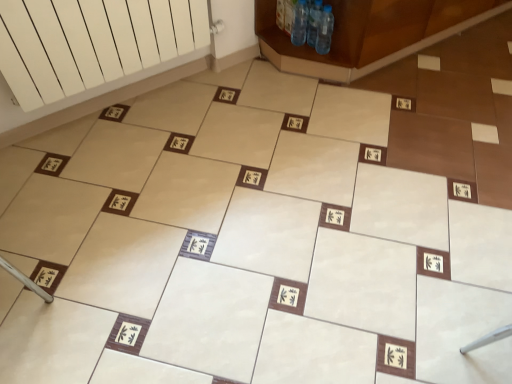
The height and width of the screenshot is (384, 512). What do you see at coordinates (298, 23) in the screenshot?
I see `transparent plastic bottles at upper center, which is counted as the 1th bottle, starting from the left` at bounding box center [298, 23].

I want to click on transparent plastic bottles at upper center, positioned as the first bottle in right-to-left order, so click(x=324, y=31).

Is transparent plastic bottles at upper center, positioned as the first bottle in right-to-left order, not close to clear plastic bottle at upper center, which appears as the second bottle when viewed from the left?

No.

Does transparent plastic bottles at upper center, positioned as the first bottle in right-to-left order, come in front of clear plastic bottle at upper center, which appears as the second bottle when viewed from the left?

Yes, transparent plastic bottles at upper center, positioned as the first bottle in right-to-left order, is closer to the viewer.

Considering the sizes of transparent plastic bottles at upper center, positioned as the first bottle in right-to-left order, and clear plastic bottle at upper center, which appears as the second bottle when viewed from the right, in the image, is transparent plastic bottles at upper center, positioned as the first bottle in right-to-left order, wider or thinner than clear plastic bottle at upper center, which appears as the second bottle when viewed from the right,?

Considering their sizes, transparent plastic bottles at upper center, positioned as the first bottle in right-to-left order, looks slimmer than clear plastic bottle at upper center, which appears as the second bottle when viewed from the right.

Is white matte radiator at upper left far away from brown wooden cabinet at upper right?

No, white matte radiator at upper left is in close proximity to brown wooden cabinet at upper right.

Does point (66, 55) come closer to viewer compared to point (402, 34)?

Yes, point (66, 55) is in front of point (402, 34).

Based on the photo, between white matte radiator at upper left and brown wooden cabinet at upper right, which one has smaller size?

Smaller between the two is white matte radiator at upper left.

Is white matte radiator at upper left facing towards brown wooden cabinet at upper right?

No, white matte radiator at upper left is not turned towards brown wooden cabinet at upper right.

What's the angular difference between transparent plastic bottles at upper center, which is counted as the 3th bottle, starting from the left, and brown wooden cabinet at upper right's facing directions?

transparent plastic bottles at upper center, which is counted as the 3th bottle, starting from the left, and brown wooden cabinet at upper right are facing 90.6 degrees away from each other.

Does transparent plastic bottles at upper center, which is counted as the 3th bottle, starting from the left, turn towards brown wooden cabinet at upper right?

Yes, transparent plastic bottles at upper center, which is counted as the 3th bottle, starting from the left, is facing brown wooden cabinet at upper right.

Can you confirm if transparent plastic bottles at upper center, which is counted as the 3th bottle, starting from the left, is wider than brown wooden cabinet at upper right?

Incorrect, the width of transparent plastic bottles at upper center, which is counted as the 3th bottle, starting from the left, does not surpass that of brown wooden cabinet at upper right.

Is transparent plastic bottles at upper center, positioned as the first bottle in right-to-left order, inside the boundaries of brown wooden cabinet at upper right, or outside?

transparent plastic bottles at upper center, positioned as the first bottle in right-to-left order, fits inside brown wooden cabinet at upper right.

Which of these two, brown wooden cabinet at upper right or transparent plastic bottles at upper center, which is counted as the 3th bottle, starting from the left, is wider?

brown wooden cabinet at upper right is wider.

Can transparent plastic bottles at upper center, which is counted as the 3th bottle, starting from the left, be found inside brown wooden cabinet at upper right?

Yes, transparent plastic bottles at upper center, which is counted as the 3th bottle, starting from the left, is inside brown wooden cabinet at upper right.

From the image's perspective, is brown wooden cabinet at upper right located beneath transparent plastic bottles at upper center, which is counted as the 3th bottle, starting from the left?

No, from the image's perspective, brown wooden cabinet at upper right is not below transparent plastic bottles at upper center, which is counted as the 3th bottle, starting from the left.

What are the coordinates of `bottle that is the 3rd object located below the brown wooden cabinet at upper right (from the image's perspective)` in the screenshot? It's located at (324, 31).

Considering the sizes of objects transparent plastic bottles at upper center, which is the 3th bottle in right-to-left order, and brown wooden cabinet at upper right in the image provided, who is shorter, transparent plastic bottles at upper center, which is the 3th bottle in right-to-left order, or brown wooden cabinet at upper right?

Standing shorter between the two is transparent plastic bottles at upper center, which is the 3th bottle in right-to-left order.

Can you confirm if transparent plastic bottles at upper center, which is counted as the 1th bottle, starting from the left, is bigger than brown wooden cabinet at upper right?

No, transparent plastic bottles at upper center, which is counted as the 1th bottle, starting from the left, is not bigger than brown wooden cabinet at upper right.

How distant is transparent plastic bottles at upper center, which is counted as the 1th bottle, starting from the left, from brown wooden cabinet at upper right?

A distance of 13.89 inches exists between transparent plastic bottles at upper center, which is counted as the 1th bottle, starting from the left, and brown wooden cabinet at upper right.

Is brown wooden cabinet at upper right a part of transparent plastic bottles at upper center, which is counted as the 1th bottle, starting from the left?

No, brown wooden cabinet at upper right is not inside transparent plastic bottles at upper center, which is counted as the 1th bottle, starting from the left.

From a real-world perspective, is transparent plastic bottles at upper center, which is counted as the 1th bottle, starting from the left, positioned under transparent plastic bottles at upper center, positioned as the first bottle in right-to-left order, based on gravity?

Actually, transparent plastic bottles at upper center, which is counted as the 1th bottle, starting from the left, is physically above transparent plastic bottles at upper center, positioned as the first bottle in right-to-left order, in the real world.

Identify the location of bottle that is the 2nd one when counting rightward from the transparent plastic bottles at upper center, which is counted as the 1th bottle, starting from the left. Image resolution: width=512 pixels, height=384 pixels. (324, 31).

In the image, is transparent plastic bottles at upper center, which is the 3th bottle in right-to-left order, on the left side or the right side of transparent plastic bottles at upper center, positioned as the first bottle in right-to-left order?

transparent plastic bottles at upper center, which is the 3th bottle in right-to-left order, is to the left of transparent plastic bottles at upper center, positioned as the first bottle in right-to-left order.

Considering the sizes of objects white matte radiator at upper left and transparent plastic bottles at upper center, which is counted as the 1th bottle, starting from the left, in the image provided, who is taller, white matte radiator at upper left or transparent plastic bottles at upper center, which is counted as the 1th bottle, starting from the left,?

Standing taller between the two is white matte radiator at upper left.

Can you confirm if white matte radiator at upper left is positioned to the left of transparent plastic bottles at upper center, which is the 3th bottle in right-to-left order?

Yes.

Is white matte radiator at upper left facing towards transparent plastic bottles at upper center, which is counted as the 1th bottle, starting from the left?

No, white matte radiator at upper left is not oriented towards transparent plastic bottles at upper center, which is counted as the 1th bottle, starting from the left.

Looking at the image, does white matte radiator at upper left seem bigger or smaller compared to transparent plastic bottles at upper center, which is the 3th bottle in right-to-left order?

Considering their sizes, white matte radiator at upper left takes up more space than transparent plastic bottles at upper center, which is the 3th bottle in right-to-left order.

Identify the location of bottle that appears below the clear plastic bottle at upper center, which appears as the second bottle when viewed from the left (from the image's perspective). [x=324, y=31].

At what (x,y) coordinates should I click in order to perform the action: click on furniture located behind the white matte radiator at upper left. Please return your answer as a coordinate pair (x, y). This screenshot has width=512, height=384. Looking at the image, I should click on (370, 33).

From the image, which object appears to be farther from white matte radiator at upper left, brown wooden cabinet at upper right or transparent plastic bottles at upper center, which is counted as the 3th bottle, starting from the left?

Based on the image, transparent plastic bottles at upper center, which is counted as the 3th bottle, starting from the left, appears to be further to white matte radiator at upper left.

Estimate the real-world distances between objects in this image. Which object is closer to white matte radiator at upper left, clear plastic bottle at upper center, which appears as the second bottle when viewed from the right, or brown wooden cabinet at upper right?

The object closer to white matte radiator at upper left is brown wooden cabinet at upper right.

When comparing their distances from white matte radiator at upper left, does transparent plastic bottles at upper center, which is counted as the 3th bottle, starting from the left, or brown wooden cabinet at upper right seem further?

The object further to white matte radiator at upper left is transparent plastic bottles at upper center, which is counted as the 3th bottle, starting from the left.

Considering their positions, is transparent plastic bottles at upper center, positioned as the first bottle in right-to-left order, positioned closer to clear plastic bottle at upper center, which appears as the second bottle when viewed from the left, than brown wooden cabinet at upper right?

Among the two, transparent plastic bottles at upper center, positioned as the first bottle in right-to-left order, is located nearer to clear plastic bottle at upper center, which appears as the second bottle when viewed from the left.

From the image, which object appears to be nearer to white matte radiator at upper left, clear plastic bottle at upper center, which appears as the second bottle when viewed from the left, or transparent plastic bottles at upper center, positioned as the first bottle in right-to-left order?

The object closer to white matte radiator at upper left is clear plastic bottle at upper center, which appears as the second bottle when viewed from the left.

Based on their spatial positions, is white matte radiator at upper left or clear plastic bottle at upper center, which appears as the second bottle when viewed from the left, further from transparent plastic bottles at upper center, which is counted as the 3th bottle, starting from the left?

white matte radiator at upper left lies further to transparent plastic bottles at upper center, which is counted as the 3th bottle, starting from the left, than the other object.

Looking at the image, which one is located further to brown wooden cabinet at upper right, clear plastic bottle at upper center, which appears as the second bottle when viewed from the left, or transparent plastic bottles at upper center, which is counted as the 1th bottle, starting from the left?

Among the two, transparent plastic bottles at upper center, which is counted as the 1th bottle, starting from the left, is located further to brown wooden cabinet at upper right.

Estimate the real-world distances between objects in this image. Which object is further from transparent plastic bottles at upper center, which is counted as the 1th bottle, starting from the left, white matte radiator at upper left or clear plastic bottle at upper center, which appears as the second bottle when viewed from the right?

Among the two, white matte radiator at upper left is located further to transparent plastic bottles at upper center, which is counted as the 1th bottle, starting from the left.

This screenshot has width=512, height=384. What are the coordinates of `bottle between transparent plastic bottles at upper center, which is counted as the 1th bottle, starting from the left, and transparent plastic bottles at upper center, positioned as the first bottle in right-to-left order, from left to right` in the screenshot? It's located at (313, 22).

The height and width of the screenshot is (384, 512). In order to click on bottle located between white matte radiator at upper left and clear plastic bottle at upper center, which appears as the second bottle when viewed from the right, in the left-right direction in this screenshot , I will do `click(298, 23)`.

The height and width of the screenshot is (384, 512). Identify the location of bottle between clear plastic bottle at upper center, which appears as the second bottle when viewed from the right, and brown wooden cabinet at upper right. (324, 31).